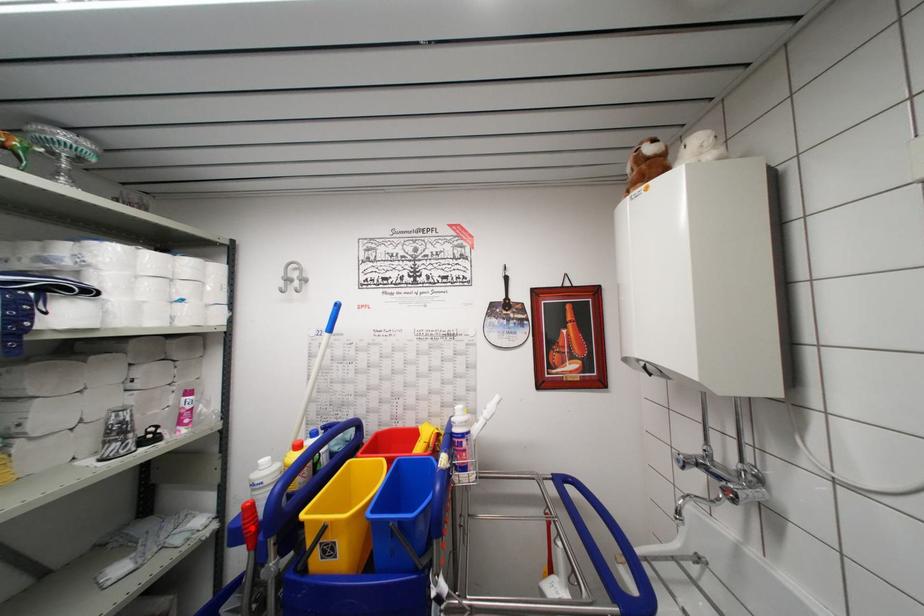
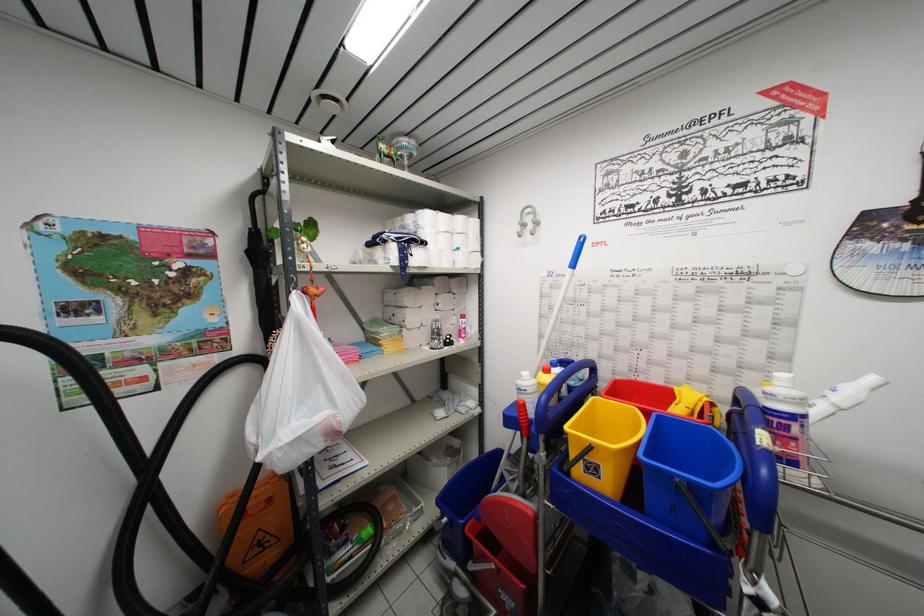
Locate, in the second image, the point that corresponds to the highlighted location in the first image.

(526, 421)